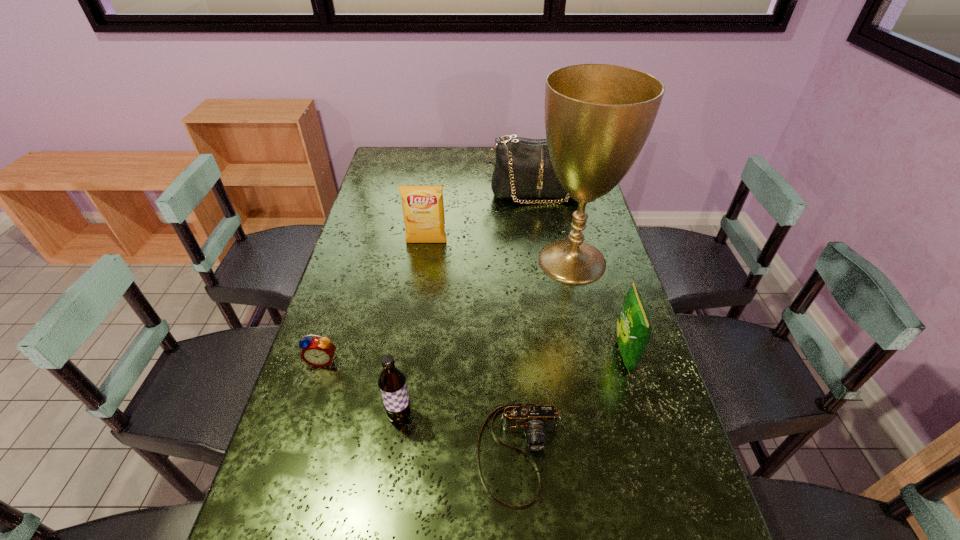
This screenshot has width=960, height=540. Identify the location of vacant space located at the front of the handbag with chain and zipper. (547, 260).

Where is `vacant space located 0.170m on the front of the left crisp (potato chip) with the logo`? The height and width of the screenshot is (540, 960). vacant space located 0.170m on the front of the left crisp (potato chip) with the logo is located at coordinates (421, 282).

In order to click on free spot located 0.130m on the right of the root beer in this screenshot , I will do `click(468, 415)`.

Locate an element on the screen. This screenshot has height=540, width=960. free space located on the front-facing side of the nearer crisp (potato chip) is located at coordinates (584, 354).

Where is `vacant space located 0.250m on the front-facing side of the nearer crisp (potato chip)`? The width and height of the screenshot is (960, 540). vacant space located 0.250m on the front-facing side of the nearer crisp (potato chip) is located at coordinates (520, 354).

What are the coordinates of `vacant area situated on the front-facing side of the nearer crisp (potato chip)` in the screenshot? It's located at (516, 354).

Where is `free spot located on the front-facing side of the alarm clock`? The image size is (960, 540). free spot located on the front-facing side of the alarm clock is located at coordinates (289, 468).

Where is `object located at the left edge`? This screenshot has height=540, width=960. object located at the left edge is located at coordinates (319, 352).

Locate an element on the screen. The height and width of the screenshot is (540, 960). trophy cup located in the right edge section of the desktop is located at coordinates (598, 117).

This screenshot has height=540, width=960. What are the coordinates of `handbag positioned at the right edge` in the screenshot? It's located at (523, 169).